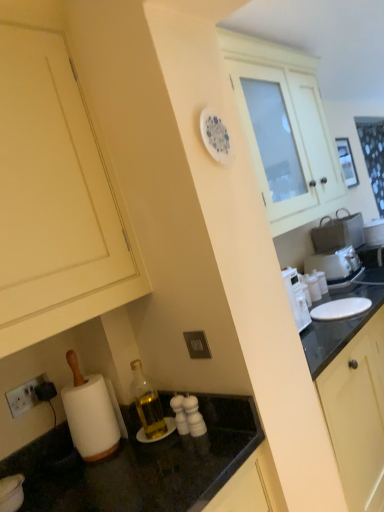
At what (x,y) coordinates should I click in order to perform the action: click on white glossy cabinet at upper center, placed as the 2th cabinetry when sorted from front to back. Please return your answer as a coordinate pair (x, y). Looking at the image, I should click on point(289,127).

Could you tell me if white glossy cabinet at upper center, which appears as the 1th cabinetry when viewed from the right, is turned towards white plastic toaster at right?

No.

Can you confirm if white glossy cabinet at upper center, positioned as the second cabinetry in left-to-right order, is smaller than white plastic toaster at right?

No, white glossy cabinet at upper center, positioned as the second cabinetry in left-to-right order, is not smaller than white plastic toaster at right.

From a real-world perspective, is white glossy cabinet at upper center, positioned as the second cabinetry in left-to-right order, physically below white plastic toaster at right?

No, from a real-world perspective, white glossy cabinet at upper center, positioned as the second cabinetry in left-to-right order, is not under white plastic toaster at right.

Which is more to the left, matte cream cabinet at lower left, which is the second cabinetry from right to left, or white plastic toaster at right?

Positioned to the left is matte cream cabinet at lower left, which is the second cabinetry from right to left.

Is matte cream cabinet at lower left, the 2th cabinetry from the back, shorter than white plastic toaster at right?

Incorrect, the height of matte cream cabinet at lower left, the 2th cabinetry from the back, does not fall short of that of white plastic toaster at right.

Would you say matte cream cabinet at lower left, placed as the first cabinetry when sorted from left to right, is inside or outside white plastic toaster at right?

matte cream cabinet at lower left, placed as the first cabinetry when sorted from left to right, is not inside white plastic toaster at right, it's outside.

From the picture: Is the depth of white glossy cabinet at upper center, placed as the 2th cabinetry when sorted from front to back, less than that of matte cream cabinet at lower left, the 2th cabinetry from the back?

No, the depth of white glossy cabinet at upper center, placed as the 2th cabinetry when sorted from front to back, is greater than that of matte cream cabinet at lower left, the 2th cabinetry from the back.

From a real-world perspective, who is located lower, white glossy cabinet at upper center, which appears as the 1th cabinetry when viewed from the right, or matte cream cabinet at lower left, the first cabinetry when ordered from front to back?

white glossy cabinet at upper center, which appears as the 1th cabinetry when viewed from the right.

Could you tell me if white glossy cabinet at upper center, positioned as the second cabinetry in left-to-right order, is facing matte cream cabinet at lower left, placed as the first cabinetry when sorted from left to right?

No.

From a real-world perspective, between white plastic toaster at right and white glossy cabinet at upper center, placed as the 2th cabinetry when sorted from front to back, who is vertically higher?

From a 3D spatial view, white glossy cabinet at upper center, placed as the 2th cabinetry when sorted from front to back, is above.

Identify the location of appliance behind the white glossy cabinet at upper center, which appears as the 1th cabinetry when viewed from the right. (335, 265).

Is white plastic toaster at right thinner than white glossy cabinet at upper center, positioned as the second cabinetry in left-to-right order?

Yes.

Is point (305, 264) closer or farther from the camera than point (61, 330)?

Clearly, point (305, 264) is more distant from the camera than point (61, 330).

Is the surface of white plastic toaster at right in direct contact with matte cream cabinet at lower left, the 2th cabinetry from the back?

No, white plastic toaster at right is not in contact with matte cream cabinet at lower left, the 2th cabinetry from the back.

Can you confirm if white plastic toaster at right is positioned to the right of matte cream cabinet at lower left, placed as the first cabinetry when sorted from left to right?

Correct, you'll find white plastic toaster at right to the right of matte cream cabinet at lower left, placed as the first cabinetry when sorted from left to right.

Which of these two, matte cream cabinet at lower left, the 2th cabinetry from the back, or white glossy cabinet at upper center, which appears as the 1th cabinetry when viewed from the back, stands taller?

matte cream cabinet at lower left, the 2th cabinetry from the back.

Visually, is matte cream cabinet at lower left, the 2th cabinetry from the back, positioned to the left or to the right of white glossy cabinet at upper center, placed as the 2th cabinetry when sorted from front to back?

In the image, matte cream cabinet at lower left, the 2th cabinetry from the back, appears on the left side of white glossy cabinet at upper center, placed as the 2th cabinetry when sorted from front to back.

How much distance is there between matte cream cabinet at lower left, placed as the first cabinetry when sorted from left to right, and white glossy cabinet at upper center, placed as the 2th cabinetry when sorted from front to back?

The distance of matte cream cabinet at lower left, placed as the first cabinetry when sorted from left to right, from white glossy cabinet at upper center, placed as the 2th cabinetry when sorted from front to back, is 3.61 feet.

From the image's perspective, is matte cream cabinet at lower left, which is the second cabinetry from right to left, located beneath white glossy cabinet at upper center, placed as the 2th cabinetry when sorted from front to back?

Indeed, from the image's perspective, matte cream cabinet at lower left, which is the second cabinetry from right to left, is shown beneath white glossy cabinet at upper center, placed as the 2th cabinetry when sorted from front to back.

Find the location of `appliance on the right of white glossy cabinet at upper center, which appears as the 1th cabinetry when viewed from the right`. appliance on the right of white glossy cabinet at upper center, which appears as the 1th cabinetry when viewed from the right is located at coordinates (335, 265).

Image resolution: width=384 pixels, height=512 pixels. In order to click on the 2nd cabinetry to the left of the white plastic toaster at right, starting your count from the anchor in this screenshot , I will do `click(55, 199)`.

Estimate the real-world distances between objects in this image. Which object is further from white plastic toaster at right, white glossy cabinet at upper center, which appears as the 1th cabinetry when viewed from the back, or matte cream cabinet at lower left, the first cabinetry when ordered from front to back?

Based on the image, matte cream cabinet at lower left, the first cabinetry when ordered from front to back, appears to be further to white plastic toaster at right.

Estimate the real-world distances between objects in this image. Which object is closer to white plastic toaster at right, matte cream cabinet at lower left, which is the second cabinetry from right to left, or white glossy cabinet at upper center, which appears as the 1th cabinetry when viewed from the back?

white glossy cabinet at upper center, which appears as the 1th cabinetry when viewed from the back, is positioned closer to the anchor white plastic toaster at right.

When comparing their distances from white glossy cabinet at upper center, placed as the 2th cabinetry when sorted from front to back, does white plastic toaster at right or matte cream cabinet at lower left, the 2th cabinetry from the back, seem further?

Based on the image, matte cream cabinet at lower left, the 2th cabinetry from the back, appears to be further to white glossy cabinet at upper center, placed as the 2th cabinetry when sorted from front to back.

When comparing their distances from matte cream cabinet at lower left, the first cabinetry when ordered from front to back, does white glossy cabinet at upper center, which appears as the 1th cabinetry when viewed from the right, or white plastic toaster at right seem closer?

Among the two, white glossy cabinet at upper center, which appears as the 1th cabinetry when viewed from the right, is located nearer to matte cream cabinet at lower left, the first cabinetry when ordered from front to back.

Estimate the real-world distances between objects in this image. Which object is closer to matte cream cabinet at lower left, placed as the first cabinetry when sorted from left to right, white plastic toaster at right or white glossy cabinet at upper center, placed as the 2th cabinetry when sorted from front to back?

Among the two, white glossy cabinet at upper center, placed as the 2th cabinetry when sorted from front to back, is located nearer to matte cream cabinet at lower left, placed as the first cabinetry when sorted from left to right.

Consider the image. Based on their spatial positions, is matte cream cabinet at lower left, the first cabinetry when ordered from front to back, or white plastic toaster at right closer to white glossy cabinet at upper center, which appears as the 1th cabinetry when viewed from the right?

The object closer to white glossy cabinet at upper center, which appears as the 1th cabinetry when viewed from the right, is white plastic toaster at right.

Identify the location of cabinetry positioned between matte cream cabinet at lower left, which is the second cabinetry from right to left, and white plastic toaster at right from near to far. (289, 127).